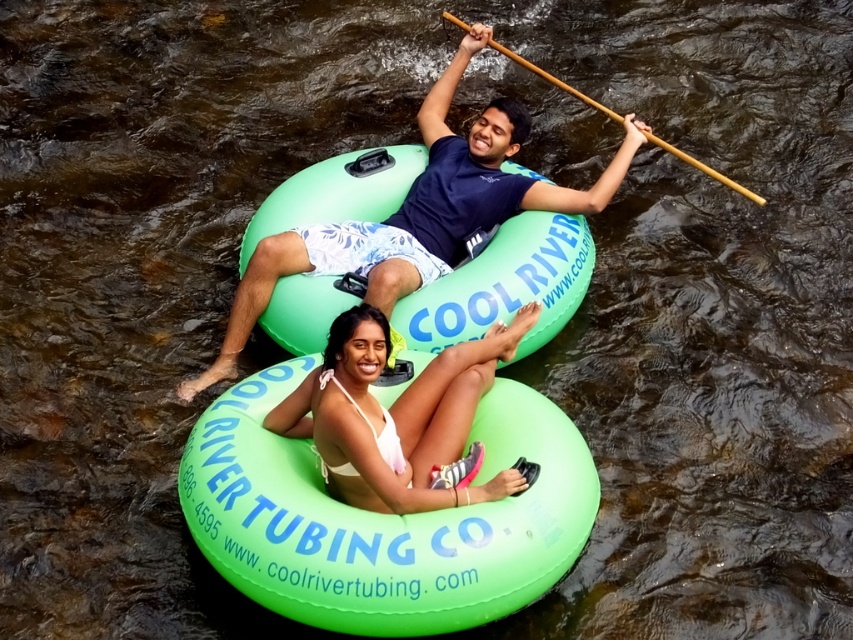
Question: Is matte green tube at center further to the viewer compared to white bikini bottom at center?

Choices:
 (A) yes
 (B) no

Answer: (A)

Question: Is matte green tube at center to the left of wooden paddle at upper center from the viewer's perspective?

Choices:
 (A) yes
 (B) no

Answer: (A)

Question: Estimate the real-world distances between objects in this image. Which object is farther from the matte green tube at center?

Choices:
 (A) wooden paddle at upper center
 (B) white bikini bottom at center

Answer: (A)

Question: Estimate the real-world distances between objects in this image. Which object is farther from the matte green tube at center?

Choices:
 (A) wooden paddle at upper center
 (B) white bikini bottom at center

Answer: (A)

Question: Which point is closer to the camera?

Choices:
 (A) wooden paddle at upper center
 (B) matte green tube at center
 (C) white bikini bottom at center

Answer: (C)

Question: Can you confirm if matte green tube at center is thinner than wooden paddle at upper center?

Choices:
 (A) yes
 (B) no

Answer: (B)